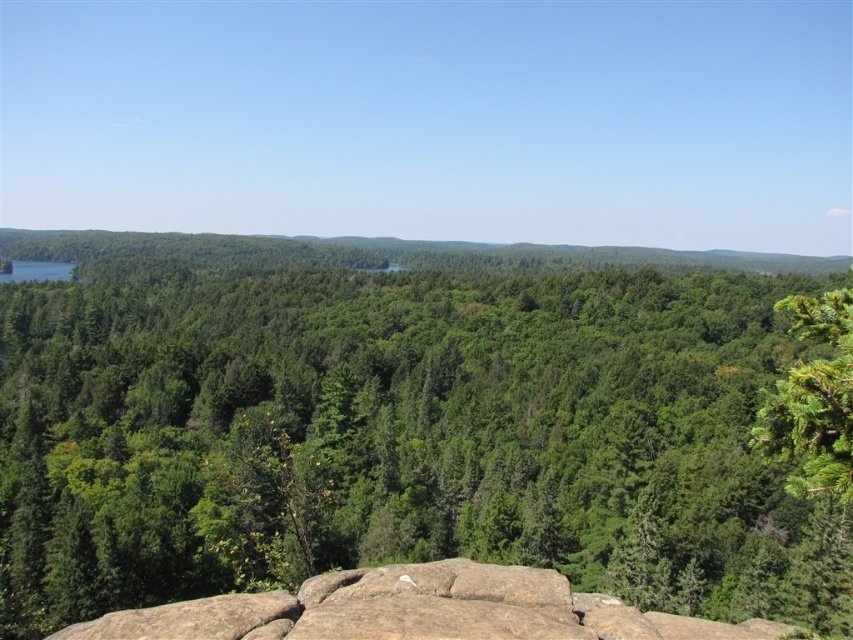
Question: Which point is closer to the camera?

Choices:
 (A) (579, 376)
 (B) (437, 593)

Answer: (B)

Question: Is green leafy forest at center positioned before green textured pine tree at right?

Choices:
 (A) no
 (B) yes

Answer: (A)

Question: Among these objects, which one is nearest to the camera?

Choices:
 (A) green leafy forest at center
 (B) green textured pine tree at right

Answer: (B)

Question: Which point appears farthest from the camera in this image?

Choices:
 (A) (761, 426)
 (B) (320, 589)

Answer: (B)

Question: Does brown rough rock at bottom center have a lesser width compared to green textured pine tree at right?

Choices:
 (A) yes
 (B) no

Answer: (A)

Question: Does green leafy forest at center appear on the left side of green textured pine tree at right?

Choices:
 (A) no
 (B) yes

Answer: (B)